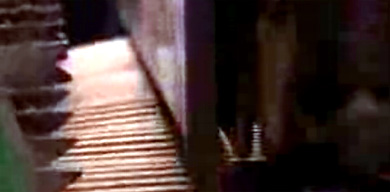
Find the location of a particular element. This screenshot has height=192, width=390. end of wall is located at coordinates (202, 93).